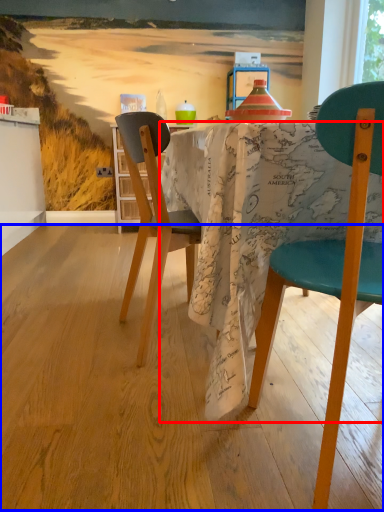
Question: Among these objects, which one is nearest to the camera, desk (highlighted by a red box) or plywood (highlighted by a blue box)?

Choices:
 (A) desk
 (B) plywood

Answer: (B)